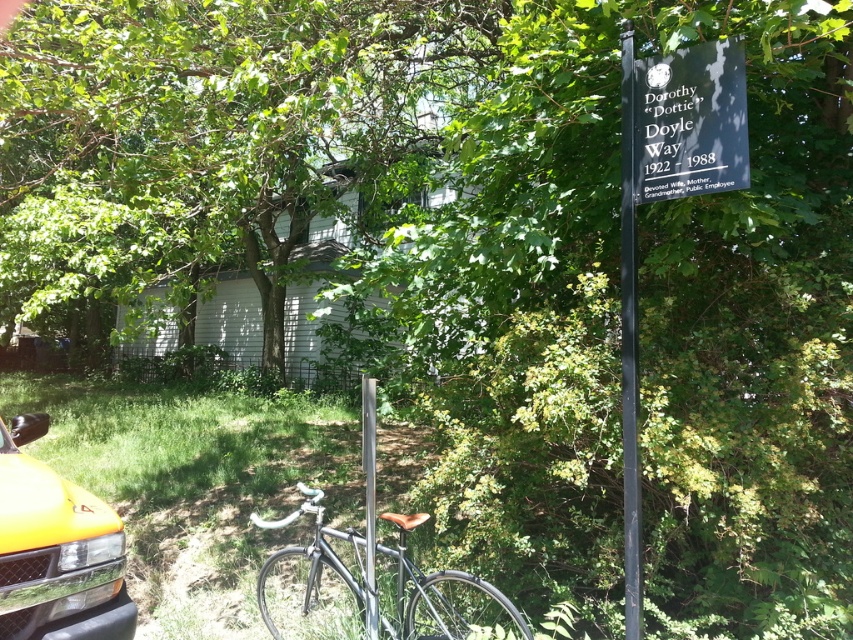
Is yellow matte car at lower left wider than silver metallic pole at center?

Yes, yellow matte car at lower left is wider than silver metallic pole at center.

Consider the image. Does yellow matte car at lower left have a lesser width compared to silver metallic pole at center?

No, yellow matte car at lower left is not thinner than silver metallic pole at center.

Is point (4, 568) closer to camera compared to point (366, 400)?

Yes, it is.

At what (x,y) coordinates should I click in order to perform the action: click on yellow matte car at lower left. Please return your answer as a coordinate pair (x, y). Looking at the image, I should click on (56, 548).

Which is above, black polished stone sign at upper right or silver metallic pole at center?

black polished stone sign at upper right

Can you confirm if black polished stone sign at upper right is wider than silver metallic pole at center?

Correct, the width of black polished stone sign at upper right exceeds that of silver metallic pole at center.

Which is behind, point (674, 144) or point (374, 417)?

Positioned behind is point (374, 417).

Identify the location of black polished stone sign at upper right. (689, 122).

Who is more forward, (305, 612) or (368, 416)?

Point (368, 416) is more forward.

Which of these two, shiny black bicycle at center or silver metallic pole at center, stands shorter?

shiny black bicycle at center

Measure the distance between shiny black bicycle at center and camera.

shiny black bicycle at center and camera are 10.47 feet apart from each other.

At what (x,y) coordinates should I click in order to perform the action: click on shiny black bicycle at center. Please return your answer as a coordinate pair (x, y). Looking at the image, I should click on (360, 586).